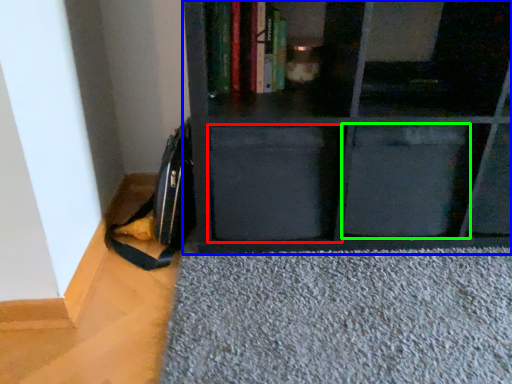
Question: Estimate the real-world distances between objects in this image. Which object is closer to drawer (highlighted by a red box), shelf (highlighted by a blue box) or drawer (highlighted by a green box)?

Choices:
 (A) shelf
 (B) drawer

Answer: (A)